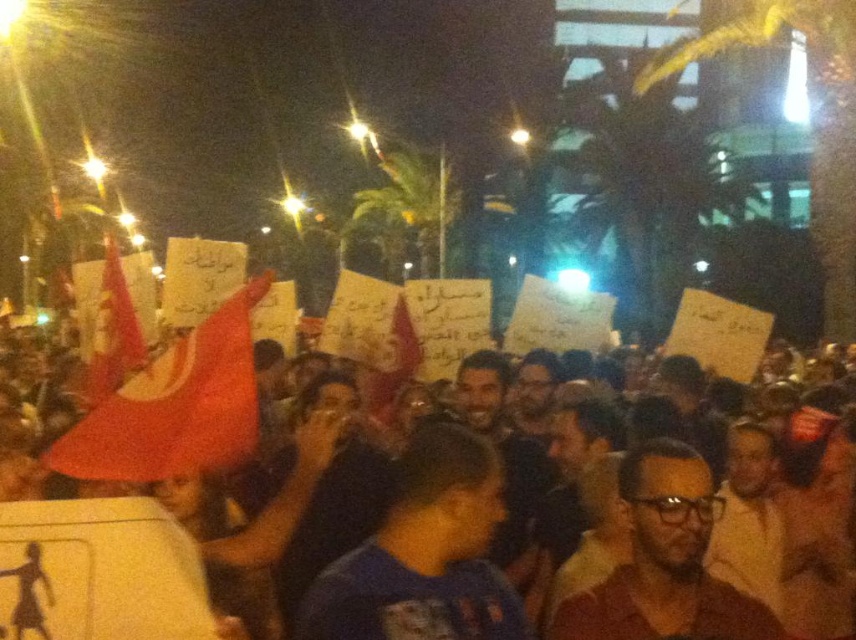
Is matte red flag at center-left below red fabric flag at left?

Yes, matte red flag at center-left is below red fabric flag at left.

Can you confirm if matte red flag at center-left is positioned to the left of red fabric flag at left?

No, matte red flag at center-left is not to the left of red fabric flag at left.

This screenshot has width=856, height=640. I want to click on matte red flag at center-left, so click(x=175, y=406).

Who is positioned more to the right, red fabric flags at center or red fabric flag at left?

red fabric flags at center

Who is more forward, (x=467, y=518) or (x=143, y=360)?

Point (x=467, y=518) is in front.

This screenshot has width=856, height=640. Identify the location of red fabric flags at center. (137, 556).

Does red fabric flags at center appear under matte red flag at center-left?

Yes.

Which is more to the left, red fabric flags at center or matte red flag at center-left?

From the viewer's perspective, matte red flag at center-left appears more on the left side.

Is point (34, 576) more distant than point (247, 435)?

No, it is in front of (247, 435).

Identify the location of red fabric flags at center. Image resolution: width=856 pixels, height=640 pixels. (137, 556).